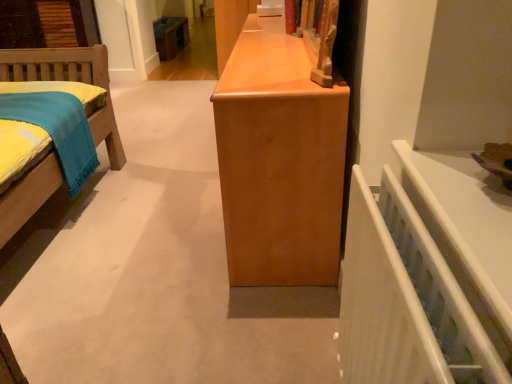
Where is `brown wood cabinet at center`? This screenshot has width=512, height=384. brown wood cabinet at center is located at coordinates (170, 36).

What do you see at coordinates (170, 36) in the screenshot? This screenshot has height=384, width=512. I see `brown wood cabinet at center` at bounding box center [170, 36].

At what (x,y) coordinates should I click in order to perform the action: click on brown wood cabinet at center. Please return your answer as a coordinate pair (x, y). Looking at the image, I should click on (170, 36).